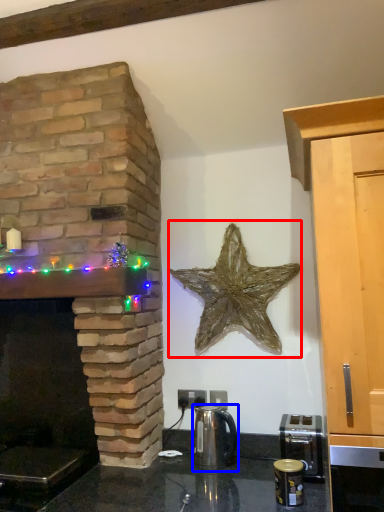
Question: Which object is closer to the camera taking this photo, starfish (highlighted by a red box) or tea pot (highlighted by a blue box)?

Choices:
 (A) starfish
 (B) tea pot

Answer: (B)